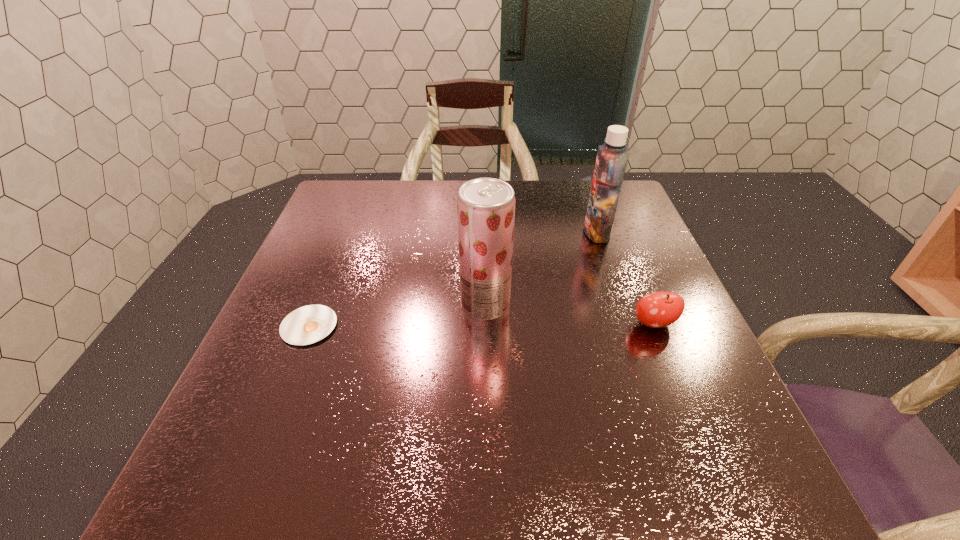
In the image, there is a desktop. Find the location of `vacant space at the far left corner`. vacant space at the far left corner is located at coordinates (366, 191).

I want to click on free spot at the near right corner of the desktop, so click(x=693, y=490).

At what (x,y) coordinates should I click in order to perform the action: click on vacant region between the leftmost object and the second shortest object. Please return your answer as a coordinate pair (x, y). Image resolution: width=960 pixels, height=540 pixels. Looking at the image, I should click on tap(482, 325).

I want to click on vacant space that is in between the leftmost object and the second shortest object, so click(482, 325).

What are the coordinates of `free space between the fruit juice and the second shortest object` in the screenshot? It's located at (x=569, y=314).

In order to click on free space between the third tallest object and the shortest object in this screenshot , I will do `click(482, 325)`.

At what (x,y) coordinates should I click in order to perform the action: click on free spot between the farthest object and the third object from right to left. Please return your answer as a coordinate pair (x, y). Looking at the image, I should click on (541, 268).

The width and height of the screenshot is (960, 540). I want to click on blank region between the fruit juice and the shampoo, so click(541, 268).

Where is `vacant point located between the leftmost object and the farthest object`? This screenshot has width=960, height=540. vacant point located between the leftmost object and the farthest object is located at coordinates (x=453, y=279).

At what (x,y) coordinates should I click in order to perform the action: click on vacant area that lies between the third object from right to left and the egg yolk. Please return your answer as a coordinate pair (x, y). Looking at the image, I should click on (397, 315).